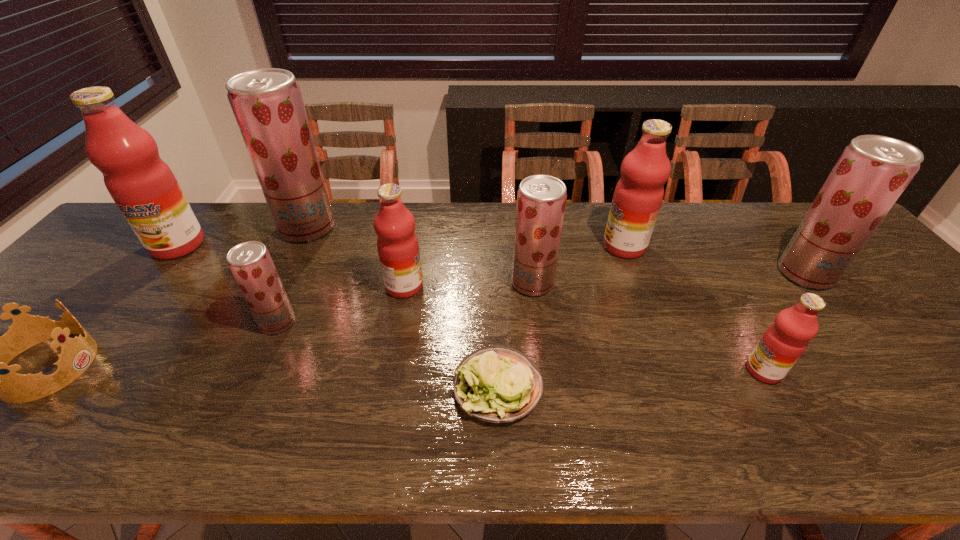
Locate an element on the screen. This screenshot has width=960, height=540. free space located 0.380m on the label of the third pink fruit juice from left to right is located at coordinates (474, 246).

Find the location of a particular element. free space located on the label of the third pink fruit juice from left to right is located at coordinates (569, 246).

At what (x,y) coordinates should I click in order to perform the action: click on blank space located 0.250m on the label of the third pink fruit juice from left to right. Please return your answer as a coordinate pair (x, y). The width and height of the screenshot is (960, 540). Looking at the image, I should click on (518, 246).

The height and width of the screenshot is (540, 960). In order to click on vacant space situated on the left of the third strawberry fruit juice from left to right in this screenshot , I will do `click(377, 283)`.

The image size is (960, 540). Find the location of `vacant area situated on the label of the third biggest pink fruit juice`. vacant area situated on the label of the third biggest pink fruit juice is located at coordinates (543, 286).

Find the location of `free spot located 0.060m on the right of the nearest strawberry fruit juice`. free spot located 0.060m on the right of the nearest strawberry fruit juice is located at coordinates (320, 322).

Find the location of a particular element. This screenshot has height=540, width=960. vacant space located 0.050m on the label of the smallest pink fruit juice is located at coordinates (724, 370).

Where is `vacant region located on the label of the smallest pink fruit juice`? The width and height of the screenshot is (960, 540). vacant region located on the label of the smallest pink fruit juice is located at coordinates (608, 370).

Where is `free region located 0.100m on the label of the smallest pink fruit juice`? This screenshot has width=960, height=540. free region located 0.100m on the label of the smallest pink fruit juice is located at coordinates (702, 370).

At what (x,y) coordinates should I click in order to perform the action: click on free space located on the left of the green lettuce. Please return your answer as a coordinate pair (x, y). The width and height of the screenshot is (960, 540). Looking at the image, I should click on (323, 387).